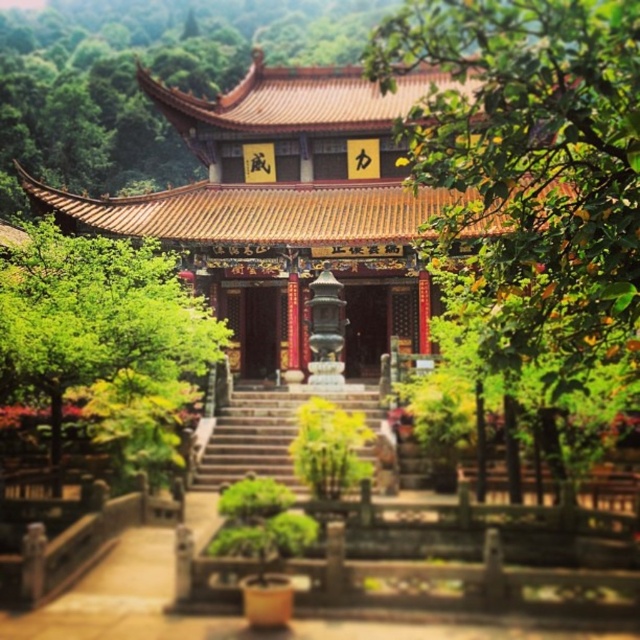
Question: Is green leafy tree at center further to camera compared to shiny gold roof at center?

Choices:
 (A) yes
 (B) no

Answer: (B)

Question: Which object appears farthest from the camera in this image?

Choices:
 (A) shiny gold roof at center
 (B) green leafy tree at left
 (C) stone stairs at center
 (D) green leafy tree at center

Answer: (C)

Question: Which point appears closest to the camera in this image?

Choices:
 (A) (380, 248)
 (B) (122, 292)
 (C) (257, 444)

Answer: (B)

Question: Is shiny gold roof at center bigger than stone stairs at center?

Choices:
 (A) yes
 (B) no

Answer: (A)

Question: Which point is closer to the camera?

Choices:
 (A) (384, 243)
 (B) (132, 420)

Answer: (B)

Question: Does green leafy tree at center have a lesser width compared to green leafy tree at left?

Choices:
 (A) yes
 (B) no

Answer: (A)